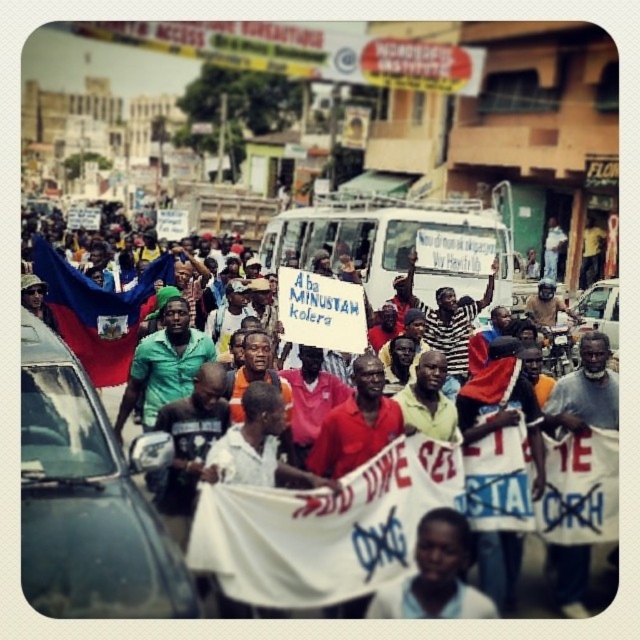
You are a photographer at the protest scene. You want to capture a photo that includes both the metallic silver car at left and the white cotton shirt at center. Which object should you focus on first to ensure both are in frame?

You should focus on the metallic silver car at left first because it occupies less space than the white cotton shirt at center, so you can adjust the camera angle to include both objects without missing the smaller one.